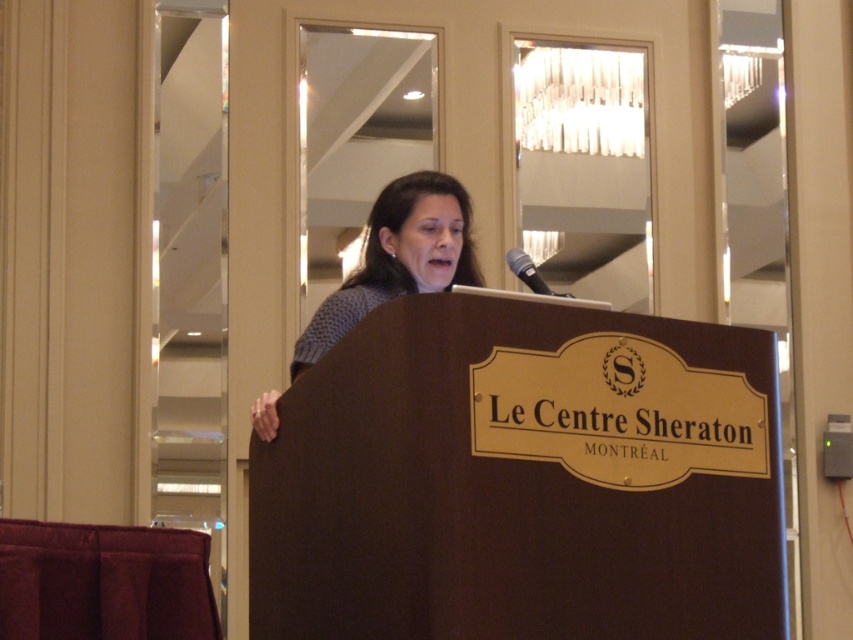
Is knitted sweater at center behind black metallic microphone at upper center?

Yes, knitted sweater at center is further from the viewer.

Which of these two, knitted sweater at center or black metallic microphone at upper center, stands taller?

Standing taller between the two is knitted sweater at center.

Does point (453, 221) come in front of point (525, 276)?

No, it is behind (525, 276).

You are a GUI agent. You are given a task and a screenshot of the screen. Output one action in this format:
    pyautogui.click(x=<x>, y=<y>)
    Task: Click on the knitted sweater at center
    This screenshot has width=853, height=640.
    Given the screenshot: What is the action you would take?
    pyautogui.click(x=398, y=257)